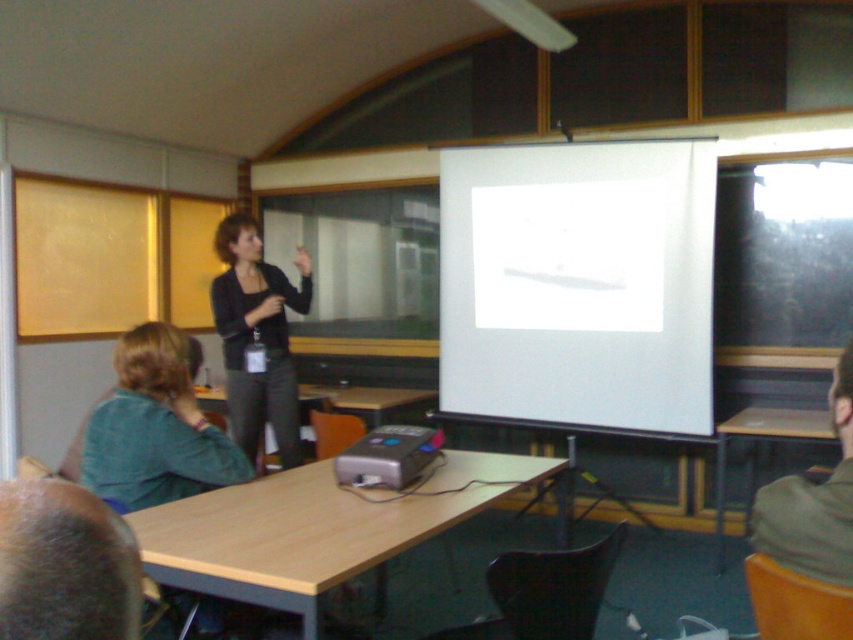
You are a student sitting in the classroom and want to place your notebook on the wooden table at center and the black fabric jacket at center. Which object can you place your notebook on?

The wooden table at center is bigger than the black fabric jacket at center, so you can place your notebook on the wooden table at center.

You are a student sitting in the classroom and need to locate the metallic gray projector at center and the white matte projection screen at center. Based on their positions, which object is to the left?

The metallic gray projector at center is to the left of the white matte projection screen at center because the screen is positioned on the right side of the projector.

You are a student sitting at the wooden table at center in the classroom. You want to look at the white matte projection screen at center. Which direction should you turn your head to see it?

Answer: The white matte projection screen at center is above the wooden table at center, so you should look upwards to see it.